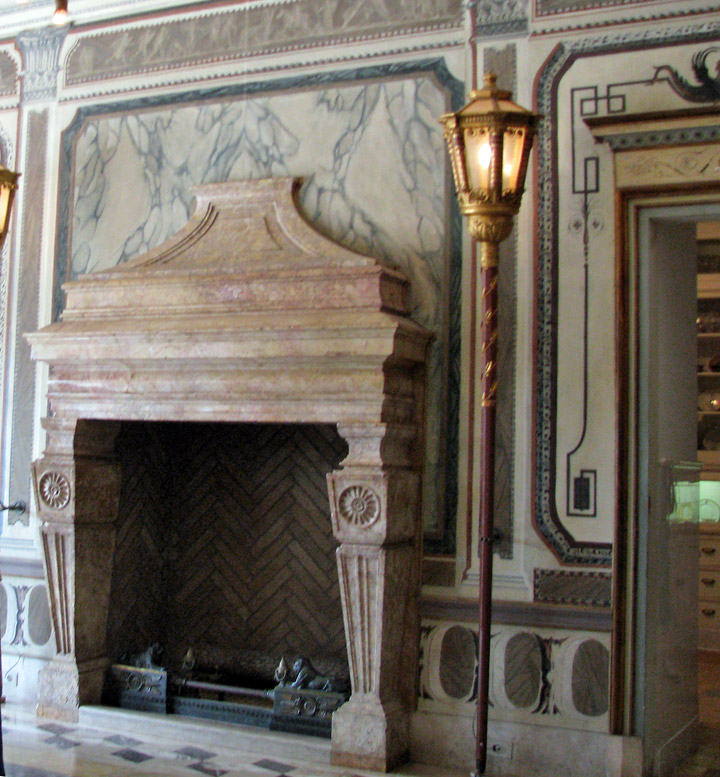
Identify the location of top of the lamp. (500, 85).